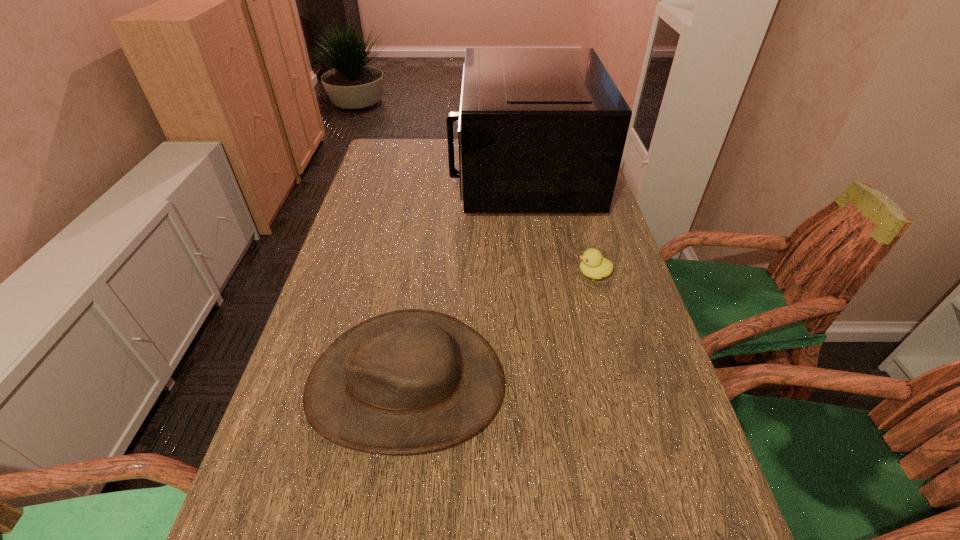
This screenshot has width=960, height=540. I want to click on vacant point at the far left corner, so click(374, 164).

What are the coordinates of `vacant point located between the duckling and the second nearest object` in the screenshot? It's located at (500, 329).

Where is `unoccupied position between the third tallest object and the second nearest object`? The width and height of the screenshot is (960, 540). unoccupied position between the third tallest object and the second nearest object is located at coordinates (500, 329).

Locate an element on the screen. free space between the third shortest object and the farthest object is located at coordinates (464, 279).

Image resolution: width=960 pixels, height=540 pixels. Find the location of `free space between the second farthest object and the cowboy hat`. free space between the second farthest object and the cowboy hat is located at coordinates (500, 329).

The height and width of the screenshot is (540, 960). I want to click on object that can be found as the closest to the tallest object, so click(x=593, y=265).

Identify the location of object that is the closest to the microwave_oven. (593, 265).

The image size is (960, 540). What are the coordinates of `free space in the image that satisfies the following two spatial constraints: 1. at the beak of the second shortest object; 2. on the front side of the cowboy hat` in the screenshot? It's located at (624, 384).